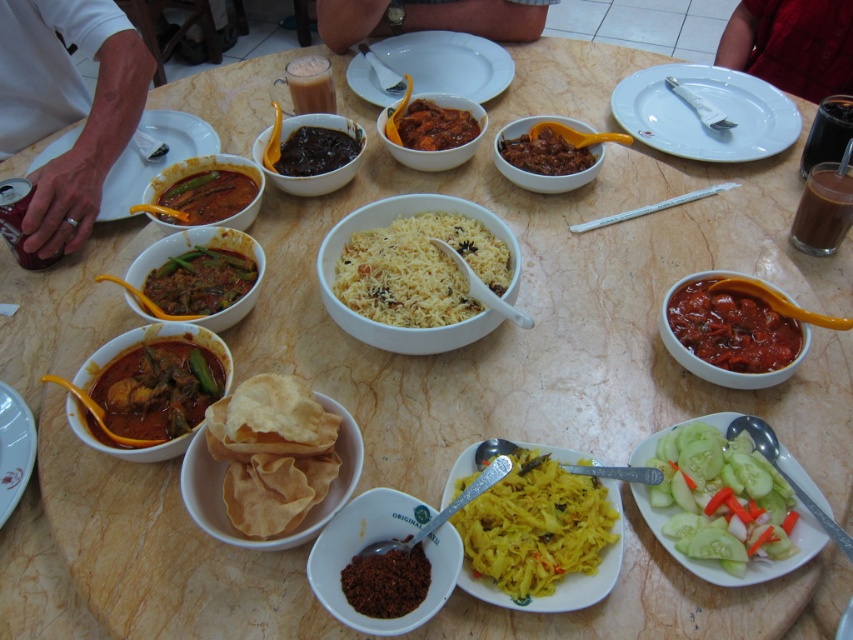
You are a chef preparing to serve a dish and need to know which of the two items at the center of the table is taller. Which one is taller between the matte brown spice at center and the dark glossy sauce at center?

The matte brown spice at center is taller than the dark glossy sauce at center according to the description.

Looking at this image, you are sitting at the round marble table and want to reach for an item located at point (358, 616) and another item at point (309, 125). Which item will you need to reach further for?

The item at point (309, 125) requires reaching further because it is farther from you than the item at point (358, 616).

You are sitting at the round marble table and want to reach both the point at coordinates (x=444, y=132) and the point at (x=293, y=168). Which point will you reach first?

You will reach the point at coordinates (x=444, y=132) first because it is closer to you than the point at (x=293, y=168).